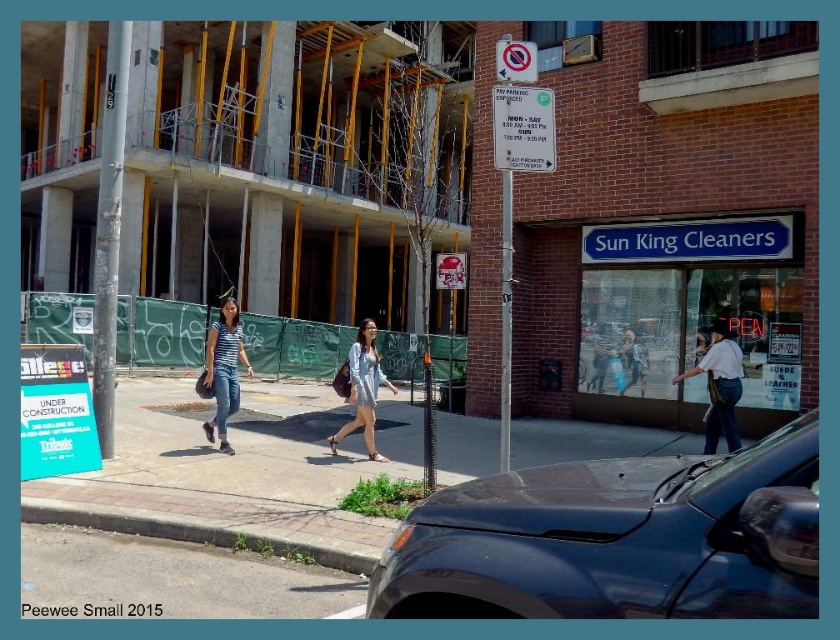
You are standing at the center of the image and want to walk to the gray concrete pavement at lower left. Which direction should you move relative to your current position?

The gray concrete pavement at lower left is located at point (174, 577), which means it is positioned to the lower left from your current position at the center. You should move downward and to the left to reach it.

You are standing on the sidewalk in this urban scene and want to place a small potted plant between the gray concrete pavement at lower left and the white paper sign at upper center. Since the gray concrete pavement is closer to you, where should you position the plant to ensure it is visible from your current viewpoint?

Place the plant near the gray concrete pavement at lower left since it is closer to you, ensuring visibility from your current viewpoint.